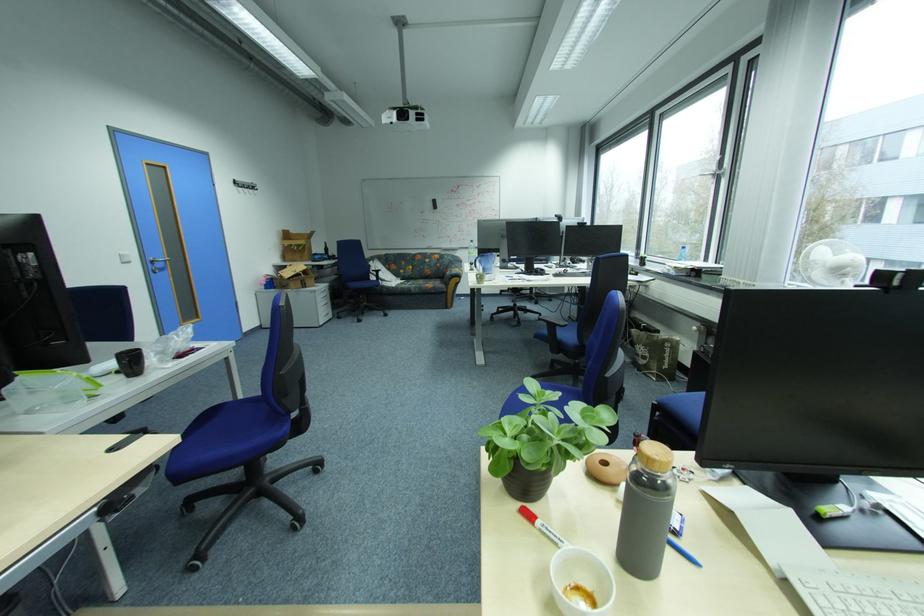
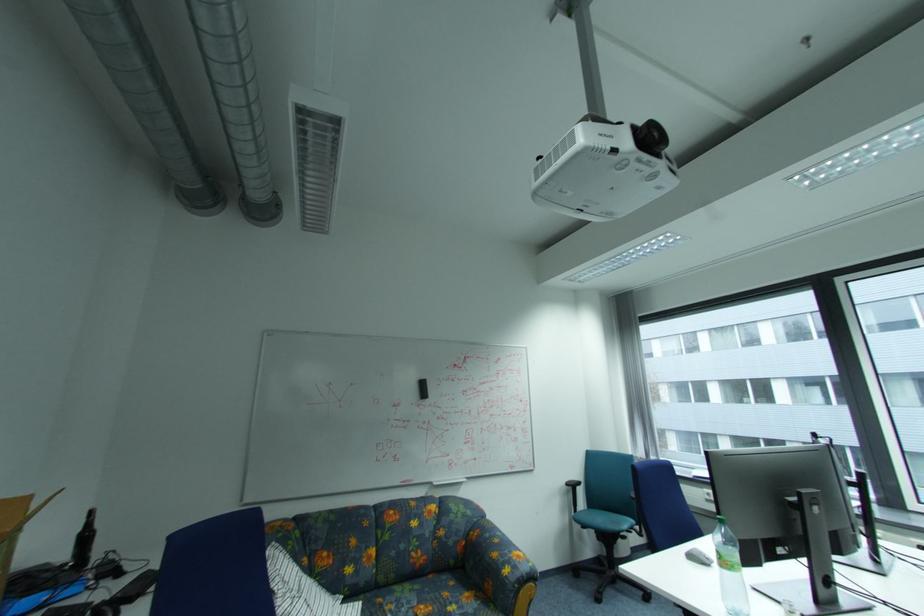
Locate, in the second image, the point that corresponds to pixel 440 206 in the first image.

(423, 391)